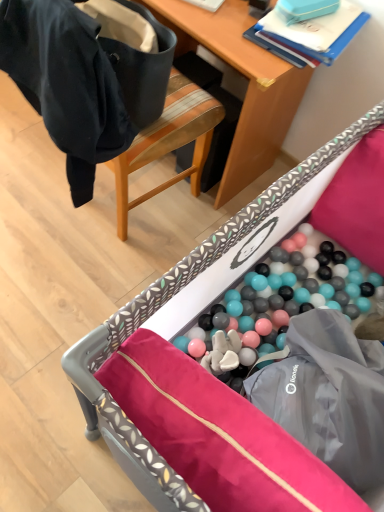
This screenshot has width=384, height=512. What do you see at coordinates (198, 306) in the screenshot?
I see `plastic ball pit at lower center` at bounding box center [198, 306].

The image size is (384, 512). I want to click on plastic ball pit at lower center, so click(x=198, y=306).

Find the location of a particular element. desk on the right of black fabric chair at upper left is located at coordinates (248, 85).

Does black fabric chair at upper left have a lesser width compared to wooden desk at upper center?

No.

From the image's perspective, is black fabric chair at upper left positioned above or below wooden desk at upper center?

Clearly, from the image's perspective, black fabric chair at upper left is below wooden desk at upper center.

From a real-world perspective, who is located lower, black fabric chair at upper left or wooden desk at upper center?

wooden desk at upper center is physically lower.

Looking at this image, relative to wooden desk at upper center, is plastic ball pit at lower center in front or behind?

Clearly, plastic ball pit at lower center is in front of wooden desk at upper center.

Is plastic ball pit at lower center looking in the opposite direction of wooden desk at upper center?

No, plastic ball pit at lower center is not facing the opposite direction of wooden desk at upper center.

In the scene shown: Is plastic ball pit at lower center beside wooden desk at upper center?

No, plastic ball pit at lower center is not making contact with wooden desk at upper center.

Locate an element on the screen. The height and width of the screenshot is (512, 384). furniture in front of the wooden desk at upper center is located at coordinates (198, 306).

Would you say wooden desk at upper center is outside black fabric chair at upper left?

Yes, wooden desk at upper center is located beyond the bounds of black fabric chair at upper left.

Which object is wider, wooden desk at upper center or black fabric chair at upper left?

black fabric chair at upper left.

From a real-world perspective, which object rests below the other?

In real-world perspective, wooden desk at upper center is lower.

Considering the positions of objects wooden desk at upper center and black fabric chair at upper left in the image provided, who is behind, wooden desk at upper center or black fabric chair at upper left?

wooden desk at upper center is further from the camera.

Between point (99, 394) and point (92, 160), which one is positioned behind?

The point (92, 160) is farther from the camera.

Looking at this image, between plastic ball pit at lower center and black fabric chair at upper left, which one has larger size?

plastic ball pit at lower center is bigger.

From the image's perspective, relative to black fabric chair at upper left, is plastic ball pit at lower center above or below?

plastic ball pit at lower center is situated lower than black fabric chair at upper left in the image.

Is plastic ball pit at lower center oriented towards black fabric chair at upper left?

Yes, plastic ball pit at lower center is turned towards black fabric chair at upper left.

Looking at this image, is black fabric chair at upper left taller or shorter than plastic ball pit at lower center?

Considering their sizes, black fabric chair at upper left has more height than plastic ball pit at lower center.

From the image's perspective, which object appears higher, black fabric chair at upper left or plastic ball pit at lower center?

black fabric chair at upper left appears higher in the image.

Is black fabric chair at upper left bigger or smaller than plastic ball pit at lower center?

Clearly, black fabric chair at upper left is smaller in size than plastic ball pit at lower center.

In terms of width, does wooden desk at upper center look wider or thinner when compared to plastic ball pit at lower center?

Clearly, wooden desk at upper center has less width compared to plastic ball pit at lower center.

Based on the photo, from a real-world perspective, is wooden desk at upper center physically above plastic ball pit at lower center?

No.

From the image's perspective, who appears lower, wooden desk at upper center or plastic ball pit at lower center?

plastic ball pit at lower center appears lower in the image.

Does wooden desk at upper center have a greater height compared to plastic ball pit at lower center?

Incorrect, the height of wooden desk at upper center is not larger of that of plastic ball pit at lower center.

The image size is (384, 512). In order to click on chair below the wooden desk at upper center (from the image's perspective) in this screenshot , I will do `click(168, 141)`.

Where is `furniture above the wooden desk at upper center (from a real-world perspective)`? Image resolution: width=384 pixels, height=512 pixels. furniture above the wooden desk at upper center (from a real-world perspective) is located at coordinates (198, 306).

When comparing their distances from black fabric chair at upper left, does plastic ball pit at lower center or wooden desk at upper center seem closer?

wooden desk at upper center is closer to black fabric chair at upper left.

Estimate the real-world distances between objects in this image. Which object is further from black fabric chair at upper left, wooden desk at upper center or plastic ball pit at lower center?

plastic ball pit at lower center is further to black fabric chair at upper left.

When comparing their distances from wooden desk at upper center, does plastic ball pit at lower center or black fabric chair at upper left seem closer?

black fabric chair at upper left is closer to wooden desk at upper center.

From the image, which object appears to be nearer to plastic ball pit at lower center, wooden desk at upper center or black fabric chair at upper left?

black fabric chair at upper left is positioned closer to the anchor plastic ball pit at lower center.

Looking at the image, which one is located closer to wooden desk at upper center, black fabric chair at upper left or plastic ball pit at lower center?

black fabric chair at upper left lies closer to wooden desk at upper center than the other object.

Based on their spatial positions, is black fabric chair at upper left or wooden desk at upper center closer to plastic ball pit at lower center?

Among the two, black fabric chair at upper left is located nearer to plastic ball pit at lower center.

Where is `chair between wooden desk at upper center and plastic ball pit at lower center in the vertical direction`? This screenshot has height=512, width=384. chair between wooden desk at upper center and plastic ball pit at lower center in the vertical direction is located at coordinates click(168, 141).